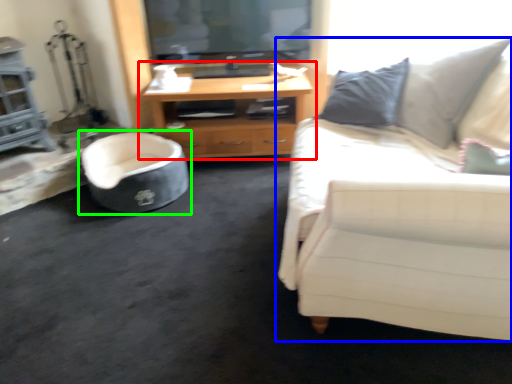
Question: Based on their relative distances, which object is nearer to cabinetry (highlighted by a red box)? Choose from studio couch (highlighted by a blue box) and chair (highlighted by a green box).

Choices:
 (A) studio couch
 (B) chair

Answer: (B)